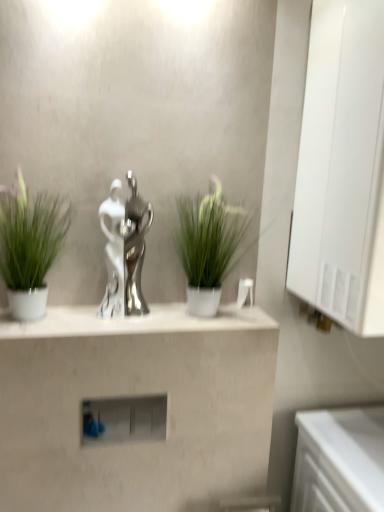
Question: Is point (99, 398) closer or farther from the camera than point (312, 287)?

Choices:
 (A) farther
 (B) closer

Answer: (B)

Question: Is matte white shelf at center in front of or behind white glossy medicine cabinet at right in the image?

Choices:
 (A) behind
 (B) front

Answer: (A)

Question: Considering the real-world distances, which object is closest to the green matte plant at left, which is counted as the first houseplant, starting from the left?

Choices:
 (A) silver metallic trophy at center
 (B) satin silver statue at center
 (C) white glossy counter at lower right
 (D) matte white shelf at center
 (E) white glossy medicine cabinet at right

Answer: (A)

Question: Based on their relative distances, which object is farther from the matte white shelf at center?

Choices:
 (A) green matte plant at left, which is counted as the first houseplant, starting from the left
 (B) white glossy counter at lower right
 (C) silver metallic trophy at center
 (D) satin silver statue at center
 (E) green matte plant at center, the first houseplant when ordered from right to left

Answer: (A)